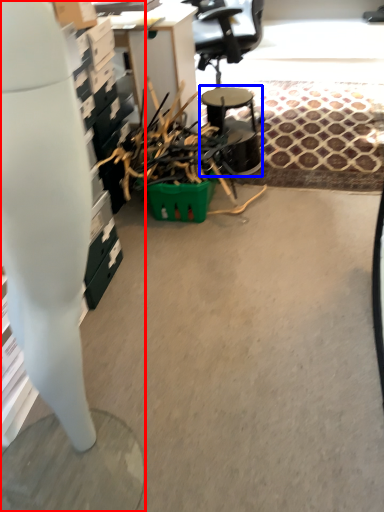
Question: Which object appears closest to the camera in this image, desk (highlighted by a red box) or round table (highlighted by a blue box)?

Choices:
 (A) desk
 (B) round table

Answer: (A)